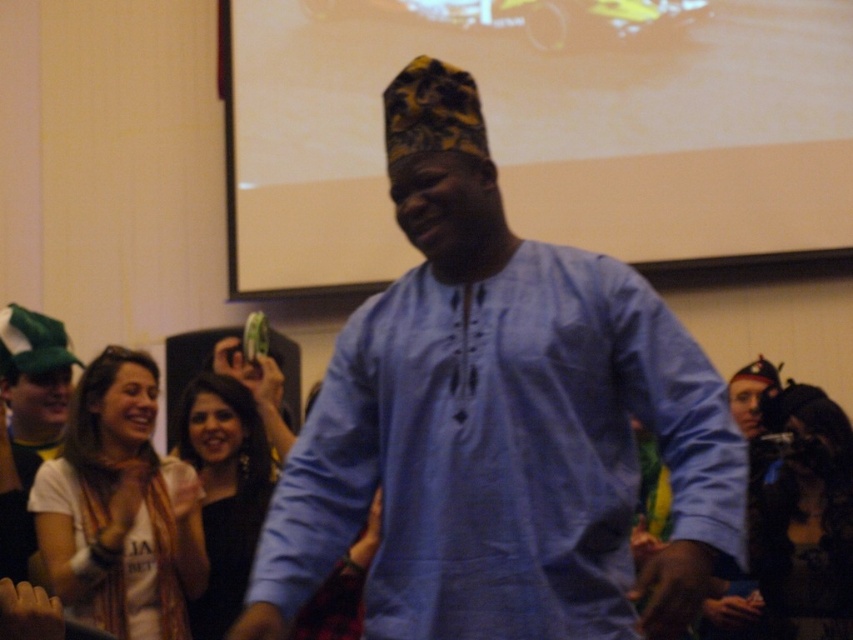
Can you confirm if white cotton scarf at left is thinner than yellow-green patterned hat at center?

No, white cotton scarf at left is not thinner than yellow-green patterned hat at center.

Between white cotton scarf at left and yellow-green patterned hat at center, which one is positioned higher?

yellow-green patterned hat at center

The width and height of the screenshot is (853, 640). I want to click on white cotton scarf at left, so click(120, 508).

Describe the element at coordinates (431, 113) in the screenshot. I see `yellow-green patterned hat at center` at that location.

Locate an element on the screen. This screenshot has width=853, height=640. yellow-green patterned hat at center is located at coordinates (431, 113).

Does point (515, 436) come closer to viewer compared to point (48, 490)?

Yes.

Which is above, blue fabric shirt at center or white cotton scarf at left?

Positioned higher is blue fabric shirt at center.

Does point (732, 428) come farther from viewer compared to point (138, 458)?

No, it is not.

Locate an element on the screen. blue fabric shirt at center is located at coordinates 502,440.